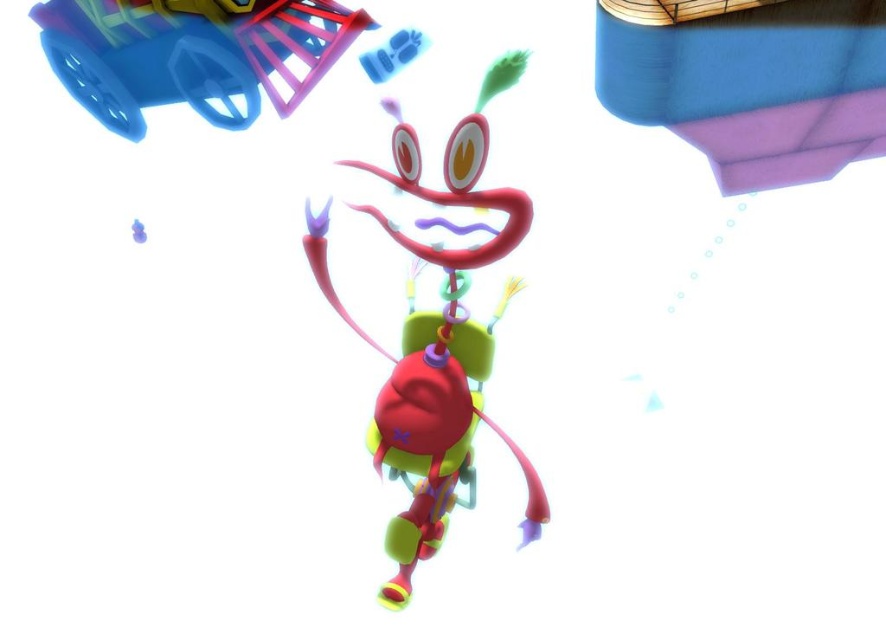
Is point (416, 396) less distant than point (355, 17)?

Yes, it is in front of point (355, 17).

Is point (385, 228) farther from viewer compared to point (114, 45)?

No, it is in front of (114, 45).

Between point (479, 328) and point (67, 61), which one is positioned behind?

The point (67, 61) is behind.

This screenshot has height=640, width=886. I want to click on glossy plastic toy at center, so click(438, 340).

Can you confirm if matte blue fabric at upper right is wider than glossy plastic toy at center?

Indeed, matte blue fabric at upper right has a greater width compared to glossy plastic toy at center.

Image resolution: width=886 pixels, height=640 pixels. I want to click on matte blue fabric at upper right, so click(x=751, y=83).

Does matte blue fabric at upper right have a greater width compared to rubberized plastic wagon at upper left?

In fact, matte blue fabric at upper right might be narrower than rubberized plastic wagon at upper left.

Which is behind, point (801, 76) or point (158, 28)?

The point (158, 28) is more distant.

The height and width of the screenshot is (640, 886). In order to click on matte blue fabric at upper right in this screenshot , I will do `click(751, 83)`.